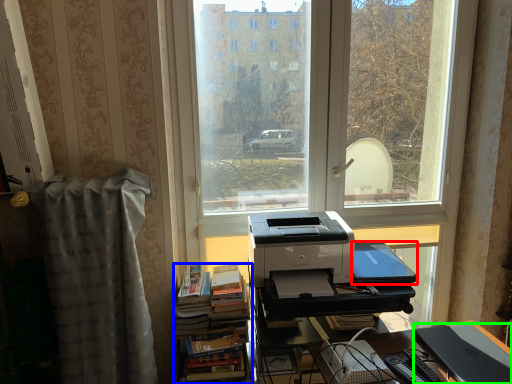
Question: Which object is positioned farthest from register (highlighted by a red box)? Select from book (highlighted by a blue box) and register (highlighted by a green box).

Choices:
 (A) book
 (B) register

Answer: (A)